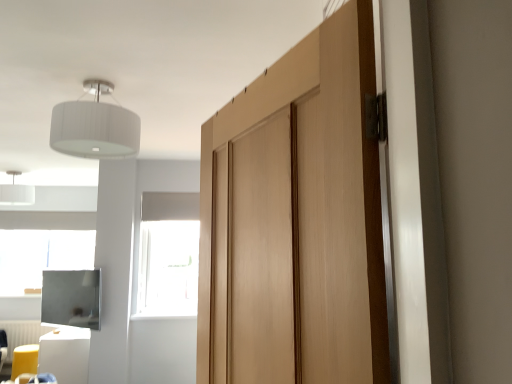
Question: Can we say white glossy cube at lower left, marked as the 2th furniture in a back-to-front arrangement, lies outside matte black screen at lower left?

Choices:
 (A) yes
 (B) no

Answer: (A)

Question: Considering the relative sizes of white glossy cube at lower left, marked as the 2th furniture in a back-to-front arrangement, and matte black screen at lower left in the image provided, is white glossy cube at lower left, marked as the 2th furniture in a back-to-front arrangement, shorter than matte black screen at lower left?

Choices:
 (A) yes
 (B) no

Answer: (B)

Question: Is white glossy cube at lower left, which is counted as the first furniture, starting from the right, not near matte black screen at lower left?

Choices:
 (A) yes
 (B) no

Answer: (B)

Question: From a real-world perspective, is white glossy cube at lower left, marked as the 2th furniture in a back-to-front arrangement, positioned over matte black screen at lower left based on gravity?

Choices:
 (A) no
 (B) yes

Answer: (A)

Question: Can you confirm if white glossy cube at lower left, marked as the 2th furniture in a back-to-front arrangement, is taller than matte black screen at lower left?

Choices:
 (A) no
 (B) yes

Answer: (B)

Question: Can you confirm if white glossy cube at lower left, acting as the 2th furniture starting from the left, is thinner than matte black screen at lower left?

Choices:
 (A) no
 (B) yes

Answer: (A)

Question: Considering the relative sizes of natural wood door at center and white glossy cube at lower left, acting as the 2th furniture starting from the left, in the image provided, is natural wood door at center thinner than white glossy cube at lower left, acting as the 2th furniture starting from the left,?

Choices:
 (A) no
 (B) yes

Answer: (B)

Question: From a real-world perspective, is natural wood door at center over white glossy cube at lower left, marked as the 2th furniture in a back-to-front arrangement?

Choices:
 (A) no
 (B) yes

Answer: (B)

Question: From the image's perspective, is natural wood door at center on white glossy cube at lower left, acting as the 2th furniture starting from the left?

Choices:
 (A) no
 (B) yes

Answer: (B)

Question: Is the position of natural wood door at center less distant than that of white glossy cube at lower left, acting as the 2th furniture starting from the left?

Choices:
 (A) yes
 (B) no

Answer: (A)

Question: From a real-world perspective, does natural wood door at center sit lower than white glossy cube at lower left, acting as the 2th furniture starting from the left?

Choices:
 (A) no
 (B) yes

Answer: (A)

Question: Are natural wood door at center and white glossy cube at lower left, which is counted as the first furniture, starting from the right, located far from each other?

Choices:
 (A) no
 (B) yes

Answer: (B)

Question: Can we say transparent glass window at center lies outside white fabric lampshade at upper left, which ranks as the first light fixture in left-to-right order?

Choices:
 (A) no
 (B) yes

Answer: (B)